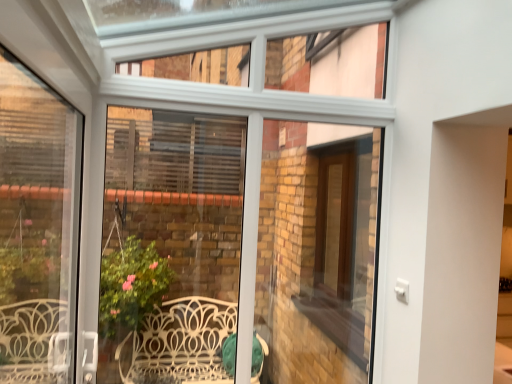
Question: Is white plastic window frame at left not within brown wooden screen door at center?

Choices:
 (A) yes
 (B) no

Answer: (A)

Question: From a real-world perspective, is white plastic window frame at left under brown wooden screen door at center?

Choices:
 (A) no
 (B) yes

Answer: (B)

Question: From the image's perspective, is white plastic window frame at left under brown wooden screen door at center?

Choices:
 (A) no
 (B) yes

Answer: (A)

Question: Is white plastic window frame at left closer to camera compared to brown wooden screen door at center?

Choices:
 (A) yes
 (B) no

Answer: (A)

Question: Is white plastic window frame at left turned away from brown wooden screen door at center?

Choices:
 (A) no
 (B) yes

Answer: (A)

Question: Is white plastic window frame at left far from brown wooden screen door at center?

Choices:
 (A) no
 (B) yes

Answer: (B)

Question: Is white plastic window frame at left inside brown wooden screen door at center?

Choices:
 (A) no
 (B) yes

Answer: (A)

Question: Considering the relative sizes of brown wooden screen door at center and white plastic window frame at left in the image provided, is brown wooden screen door at center thinner than white plastic window frame at left?

Choices:
 (A) yes
 (B) no

Answer: (A)

Question: Can you confirm if brown wooden screen door at center is shorter than white plastic window frame at left?

Choices:
 (A) yes
 (B) no

Answer: (A)

Question: Is brown wooden screen door at center positioned beyond the bounds of white plastic window frame at left?

Choices:
 (A) yes
 (B) no

Answer: (A)

Question: Is brown wooden screen door at center oriented away from white plastic window frame at left?

Choices:
 (A) yes
 (B) no

Answer: (B)

Question: Considering the relative sizes of brown wooden screen door at center and white plastic window frame at left in the image provided, is brown wooden screen door at center smaller than white plastic window frame at left?

Choices:
 (A) yes
 (B) no

Answer: (A)

Question: Considering the positions of white plastic window frame at left and brown wooden screen door at center in the image, is white plastic window frame at left wider or thinner than brown wooden screen door at center?

Choices:
 (A) thin
 (B) wide

Answer: (B)